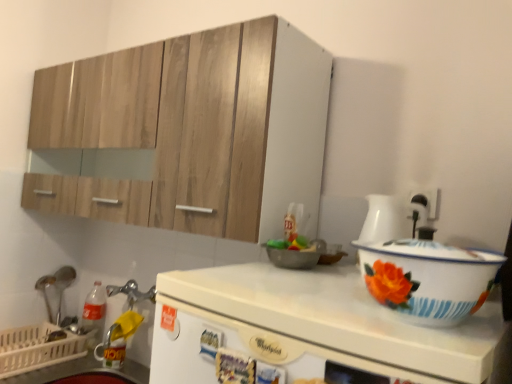
This screenshot has width=512, height=384. What do you see at coordinates (195, 128) in the screenshot?
I see `wooden cabinet at upper left` at bounding box center [195, 128].

Locate an element on the screen. white glossy counter top at lower left is located at coordinates (56, 371).

In order to face white enamel basin at right, should I rotate leftwards or rightwards?

It's best to rotate right around 21.243 degrees.

The height and width of the screenshot is (384, 512). What do you see at coordinates (305, 329) in the screenshot?
I see `white glossy whirlpool at center` at bounding box center [305, 329].

Find the location of a particular element. wooden cabinet at upper left is located at coordinates (195, 128).

Is white enamel basin at right in front of or behind wooden cabinet at upper left in the image?

Clearly, white enamel basin at right is in front of wooden cabinet at upper left.

Is white enamel basin at right surrounding wooden cabinet at upper left?

Actually, wooden cabinet at upper left is outside white enamel basin at right.

Considering the positions of objects white enamel basin at right and wooden cabinet at upper left in the image provided, who is more to the left, white enamel basin at right or wooden cabinet at upper left?

wooden cabinet at upper left.

In terms of size, does white enamel basin at right appear bigger or smaller than wooden cabinet at upper left?

In the image, white enamel basin at right appears to be smaller than wooden cabinet at upper left.

Can you confirm if white glossy counter top at lower left is positioned to the left of white enamel basin at right?

Correct, you'll find white glossy counter top at lower left to the left of white enamel basin at right.

From the image's perspective, does white glossy counter top at lower left appear higher than white enamel basin at right?

No, from the image's perspective, white glossy counter top at lower left is not on top of white enamel basin at right.

Considering the positions of objects white glossy counter top at lower left and white enamel basin at right in the image provided, who is behind, white glossy counter top at lower left or white enamel basin at right?

white glossy counter top at lower left is further away from the camera.

Is white glossy counter top at lower left situated inside white enamel basin at right or outside?

white glossy counter top at lower left lies outside white enamel basin at right.

Would you say wooden cabinet at upper left is outside white glossy counter top at lower left?

Yes.

From the picture: Is wooden cabinet at upper left turned away from white glossy counter top at lower left?

wooden cabinet at upper left does not have its back to white glossy counter top at lower left.

Considering the positions of objects wooden cabinet at upper left and white glossy counter top at lower left in the image provided, who is behind, wooden cabinet at upper left or white glossy counter top at lower left?

white glossy counter top at lower left is further away from the camera.

From a real-world perspective, is wooden cabinet at upper left above or below white glossy counter top at lower left?

wooden cabinet at upper left is situated higher than white glossy counter top at lower left in the real world.

Looking at this image, from a real-world perspective, which object rests below the other?

brushed metal spoon at left.

From the image's perspective, which is above, white glossy whirlpool at center or brushed metal spoon at left?

white glossy whirlpool at center is shown above in the image.

Is white glossy whirlpool at center closer to the viewer compared to brushed metal spoon at left?

Yes, white glossy whirlpool at center is in front of brushed metal spoon at left.

Is white glossy whirlpool at center positioned beyond the bounds of brushed metal spoon at left?

white glossy whirlpool at center lies outside brushed metal spoon at left's area.

You are a GUI agent. You are given a task and a screenshot of the screen. Output one action in this format:
    pyautogui.click(x=<x>, y=<y>)
    Task: Click on the tableware below the wooden cabinet at upper left (from the image's perspective)
    
    Given the screenshot: What is the action you would take?
    pyautogui.click(x=63, y=285)

Is wooden cabinet at upper left oriented towards brushed metal spoon at left?

No.

Does brushed metal spoon at left appear on the right side of wooden cabinet at upper left?

No.

Considering the positions of point (69, 283) and point (94, 180), is point (69, 283) closer or farther from the camera than point (94, 180)?

Point (69, 283) appears to be farther away from the viewer than point (94, 180).

Where is `cabinetry above the brushed metal spoon at left (from a real-world perspective)`? This screenshot has width=512, height=384. cabinetry above the brushed metal spoon at left (from a real-world perspective) is located at coordinates (195, 128).

From a real-world perspective, is brushed metal spoon at left on top of wooden cabinet at upper left?

No, from a real-world perspective, brushed metal spoon at left is not on top of wooden cabinet at upper left.

From a real-world perspective, between white glossy counter top at lower left and white glossy whirlpool at center, who is vertically lower?

white glossy counter top at lower left, from a real-world perspective.

Is white glossy counter top at lower left facing towards white glossy whirlpool at center?

No, white glossy counter top at lower left is not oriented towards white glossy whirlpool at center.

Consider the image. Looking at their sizes, would you say white glossy counter top at lower left is wider or thinner than white glossy whirlpool at center?

Clearly, white glossy counter top at lower left has more width compared to white glossy whirlpool at center.

Where is `countertop positioned vertically above the white glossy counter top at lower left (from a real-world perspective)`? The image size is (512, 384). countertop positioned vertically above the white glossy counter top at lower left (from a real-world perspective) is located at coordinates (305, 329).

Find the location of a particular element. This screenshot has height=384, width=512. cabinetry that is on the left side of white enamel basin at right is located at coordinates (195, 128).

Locate an element on the screen. The height and width of the screenshot is (384, 512). basin above the white glossy counter top at lower left (from a real-world perspective) is located at coordinates (426, 279).

Based on their spatial positions, is wooden cabinet at upper left or white glossy counter top at lower left closer to brushed metal spoon at left?

Among the two, white glossy counter top at lower left is located nearer to brushed metal spoon at left.

When comparing their distances from brushed metal spoon at left, does white enamel basin at right or wooden cabinet at upper left seem further?

white enamel basin at right is further to brushed metal spoon at left.

Estimate the real-world distances between objects in this image. Which object is further from brushed metal spoon at left, wooden cabinet at upper left or white glossy whirlpool at center?

Based on the image, white glossy whirlpool at center appears to be further to brushed metal spoon at left.

Consider the image. Looking at the image, which one is located further to wooden cabinet at upper left, brushed metal spoon at left or white glossy whirlpool at center?

Among the two, brushed metal spoon at left is located further to wooden cabinet at upper left.

When comparing their distances from white enamel basin at right, does brushed metal spoon at left or wooden cabinet at upper left seem further?

brushed metal spoon at left is positioned further to the anchor white enamel basin at right.

From the image, which object appears to be nearer to white glossy whirlpool at center, wooden cabinet at upper left or white enamel basin at right?

Among the two, white enamel basin at right is located nearer to white glossy whirlpool at center.

Estimate the real-world distances between objects in this image. Which object is closer to wooden cabinet at upper left, white glossy whirlpool at center or brushed metal spoon at left?

white glossy whirlpool at center is closer to wooden cabinet at upper left.

Estimate the real-world distances between objects in this image. Which object is further from white glossy whirlpool at center, wooden cabinet at upper left or brushed metal spoon at left?

Based on the image, brushed metal spoon at left appears to be further to white glossy whirlpool at center.

At what (x,y) coordinates should I click in order to perform the action: click on countertop between wooden cabinet at upper left and white enamel basin at right in the horizontal direction. Please return your answer as a coordinate pair (x, y). Looking at the image, I should click on (305, 329).

Locate an element on the screen. This screenshot has width=512, height=384. tableware between wooden cabinet at upper left and white glossy counter top at lower left in the up-down direction is located at coordinates (63, 285).

Find the location of `countertop between wooden cabinet at upper left and white glossy counter top at lower left from top to bottom`. countertop between wooden cabinet at upper left and white glossy counter top at lower left from top to bottom is located at coordinates coord(305,329).

Locate an element on the screen. basin between white glossy whirlpool at center and brushed metal spoon at left from front to back is located at coordinates (426, 279).